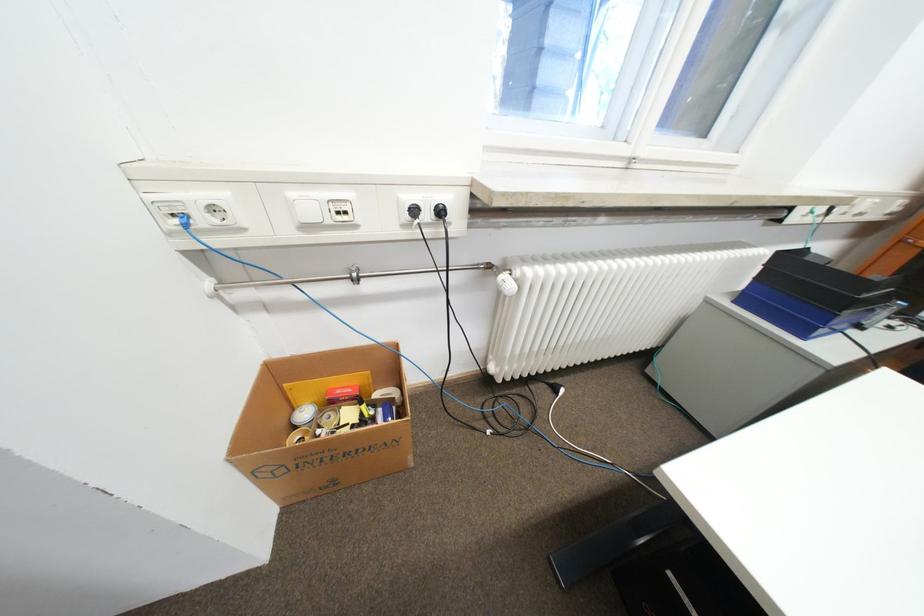
Locate an element on the screen. The height and width of the screenshot is (616, 924). white light switch is located at coordinates (308, 211).